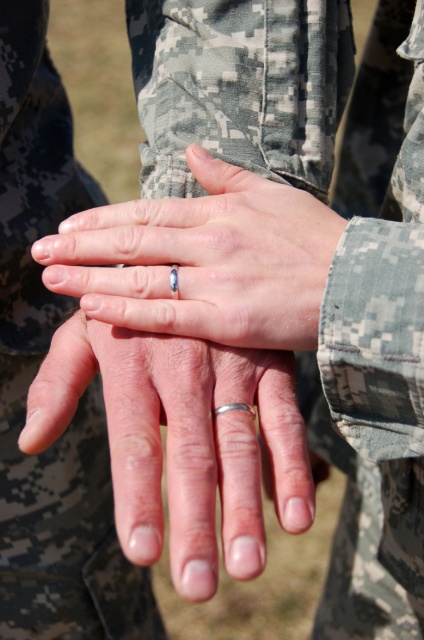
Does digital camouflage uniform at center have a greater height compared to silver metallic ring at center?

Correct, digital camouflage uniform at center is much taller as silver metallic ring at center.

Does point (35, 600) lie behind point (150, 561)?

Yes, point (35, 600) is farther from viewer.

The image size is (424, 640). Find the location of `digital camouflage uniform at center`. digital camouflage uniform at center is located at coordinates (35, 372).

Is point (306, 392) closer to viewer compared to point (28, 525)?

No, it is behind (28, 525).

Between digital camouflage fabric at center and digital camouflage uniform at center, which one appears on the left side from the viewer's perspective?

Positioned to the left is digital camouflage uniform at center.

Who is more distant from viewer, [368,509] or [72,305]?

The point [72,305] is behind.

At what (x,y) coordinates should I click in order to perform the action: click on digital camouflage fabric at center. Please return your answer as a coordinate pair (x, y). The width and height of the screenshot is (424, 640). Looking at the image, I should click on (376, 344).

Does digital camouflage fabric at center lie behind satin silver ring at center?

No, it is not.

In the scene shown: Who is more distant from viewer, (340, 317) or (309, 260)?

The point (309, 260) is behind.

Is point (356, 435) less distant than point (278, 326)?

No, it is not.

The width and height of the screenshot is (424, 640). I want to click on digital camouflage fabric at center, so click(376, 344).